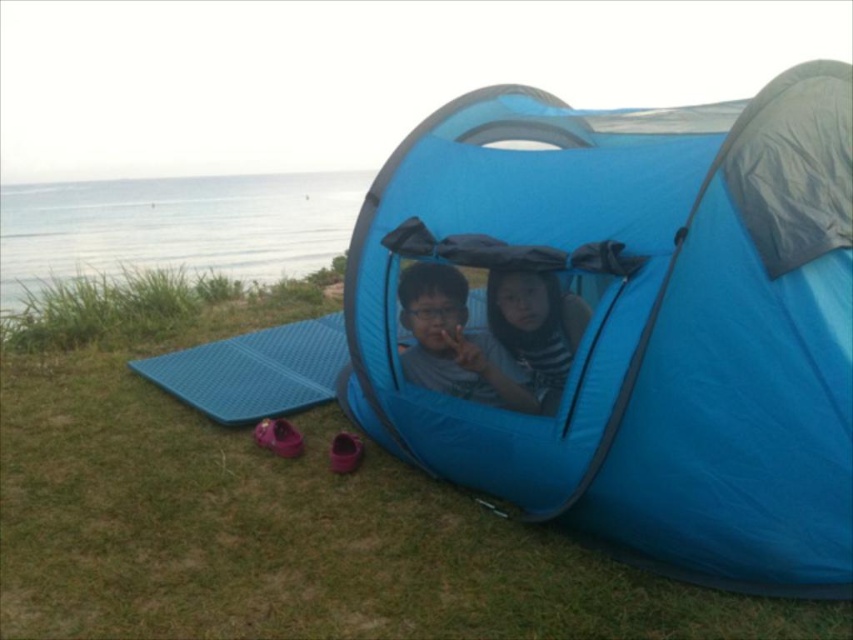
Question: Which point is closer to the camera?

Choices:
 (A) blue fabric tent at center
 (B) striped fabric shirt at center

Answer: (A)

Question: Among these points, which one is nearest to the camera?

Choices:
 (A) (666, 332)
 (B) (473, 396)

Answer: (A)

Question: Is blue fabric tent at center to the left of blue foam mat at lower center from the viewer's perspective?

Choices:
 (A) yes
 (B) no

Answer: (B)

Question: Is blue fabric tent at center positioned in front of striped fabric shirt at center?

Choices:
 (A) no
 (B) yes

Answer: (B)

Question: Is blue fabric tent at center above blue foam mat at lower center?

Choices:
 (A) no
 (B) yes

Answer: (B)

Question: Which object appears farthest from the camera in this image?

Choices:
 (A) striped fabric shirt at center
 (B) blue foam mat at lower center
 (C) matte blue tent at center

Answer: (B)